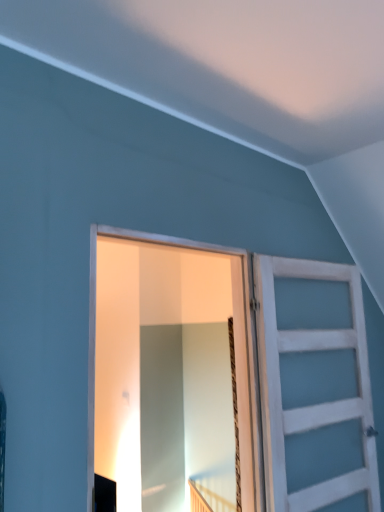
Question: Are white wooden barn door at right, the 2th barn door positioned from the left, and white wooden barn door at center, the 2th barn door viewed from the right, making contact?

Choices:
 (A) no
 (B) yes

Answer: (A)

Question: Is white wooden barn door at right, the 2th barn door positioned from the left, oriented towards white wooden barn door at center, the 1th barn door viewed from the left?

Choices:
 (A) no
 (B) yes

Answer: (A)

Question: Is white wooden barn door at center, the 1th barn door viewed from the left, inside white wooden barn door at right, the 2th barn door positioned from the left?

Choices:
 (A) no
 (B) yes

Answer: (A)

Question: From the image's perspective, is white wooden barn door at right, placed as the first barn door when sorted from right to left, above white wooden barn door at center, the 2th barn door viewed from the right?

Choices:
 (A) yes
 (B) no

Answer: (B)

Question: Can you confirm if white wooden barn door at right, the 2th barn door positioned from the left, is shorter than white wooden barn door at center, the 2th barn door viewed from the right?

Choices:
 (A) yes
 (B) no

Answer: (B)

Question: Is white wooden barn door at right, the 2th barn door positioned from the left, not within white wooden barn door at center, the 2th barn door viewed from the right?

Choices:
 (A) no
 (B) yes

Answer: (B)

Question: Could you tell me if white wooden barn door at center, the 1th barn door viewed from the left, is facing white wooden barn door at right, placed as the first barn door when sorted from right to left?

Choices:
 (A) yes
 (B) no

Answer: (B)

Question: Is white wooden barn door at center, the 1th barn door viewed from the left, not inside white wooden barn door at right, the 2th barn door positioned from the left?

Choices:
 (A) yes
 (B) no

Answer: (A)

Question: Can you confirm if white wooden barn door at center, the 2th barn door viewed from the right, is shorter than white wooden barn door at right, the 2th barn door positioned from the left?

Choices:
 (A) yes
 (B) no

Answer: (A)

Question: From the image's perspective, does white wooden barn door at center, the 2th barn door viewed from the right, appear lower than white wooden barn door at right, placed as the first barn door when sorted from right to left?

Choices:
 (A) no
 (B) yes

Answer: (A)

Question: Is white wooden barn door at center, the 1th barn door viewed from the left, not close to white wooden barn door at right, the 2th barn door positioned from the left?

Choices:
 (A) no
 (B) yes

Answer: (A)

Question: Does white wooden barn door at center, the 1th barn door viewed from the left, touch white wooden barn door at right, placed as the first barn door when sorted from right to left?

Choices:
 (A) no
 (B) yes

Answer: (A)

Question: Do you think white wooden barn door at right, placed as the first barn door when sorted from right to left, is within white wooden barn door at center, the 1th barn door viewed from the left, or outside of it?

Choices:
 (A) inside
 (B) outside

Answer: (B)